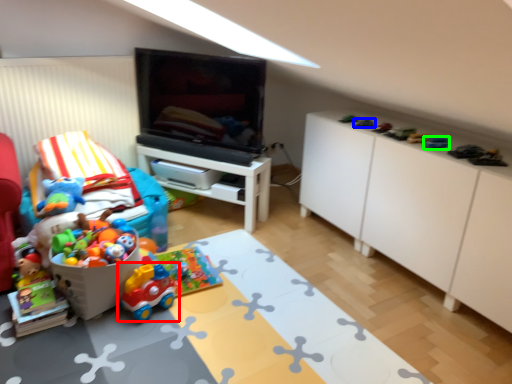
Question: Which is nearer to the toy (highlighted by a red box)? toy (highlighted by a blue box) or toy (highlighted by a green box).

Choices:
 (A) toy
 (B) toy

Answer: (A)